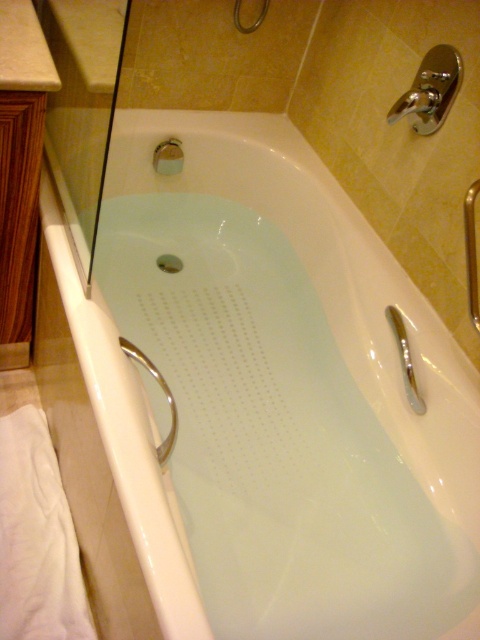
From the picture: You are a plumber inspecting the bathroom and need to locate the polished chrome shower head at upper right. According to the coordinates provided, where exactly is it positioned in the image?

The polished chrome shower head at upper right is located at point coordinates of 0.142 on the x axis and 0.898 on the y axis.

You are a maintenance worker checking the bathroom. You need to reach the polished chrome shower head at upper right for inspection. If your arm can extend 3 feet, can you reach it?

The distance of polished chrome shower head at upper right from camera is 3.93 feet, so your arm can only extend 3 feet, so you cannot reach it.

You are designing a bathroom layout and need to ensure there is enough space between the white glossy sink at upper left and the matte silver showerhead at upper center for a 16 inch wide storage cabinet. Based on the image, will the cabinet fit between them?

The white glossy sink at upper left and matte silver showerhead at upper center are 17.37 inches apart, so the 16 inch wide storage cabinet will fit between them since the distance is greater than the cabinet width.